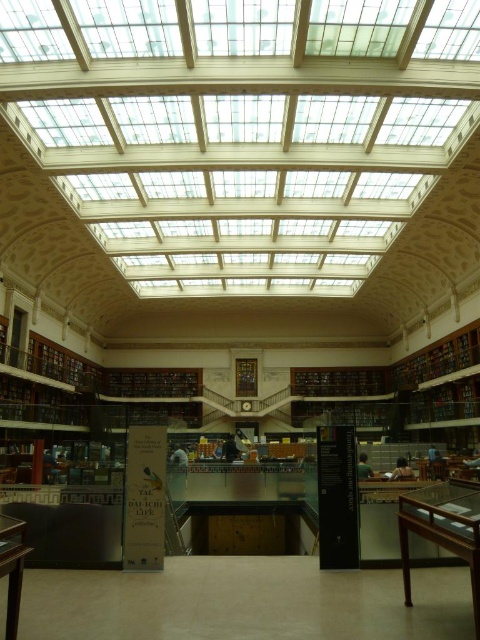
You are a visitor in the library and need to place a tall stack of books on a table. Which table between the wooden table at lower right and the wooden table at lower left would be more suitable for the stack?

The wooden table at lower right has a greater height compared to the wooden table at lower left, making it more suitable for placing a tall stack of books as it provides a stable surface at a higher level.